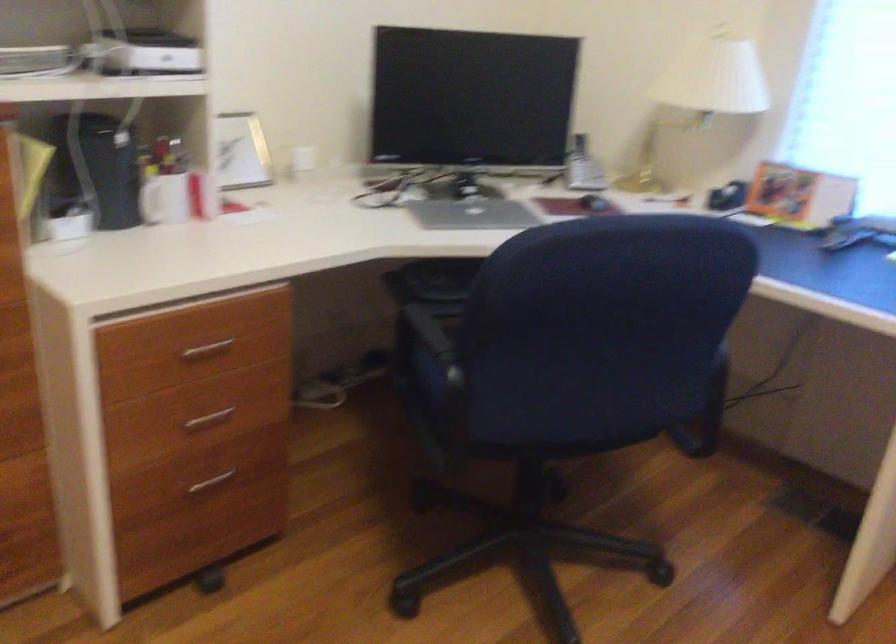
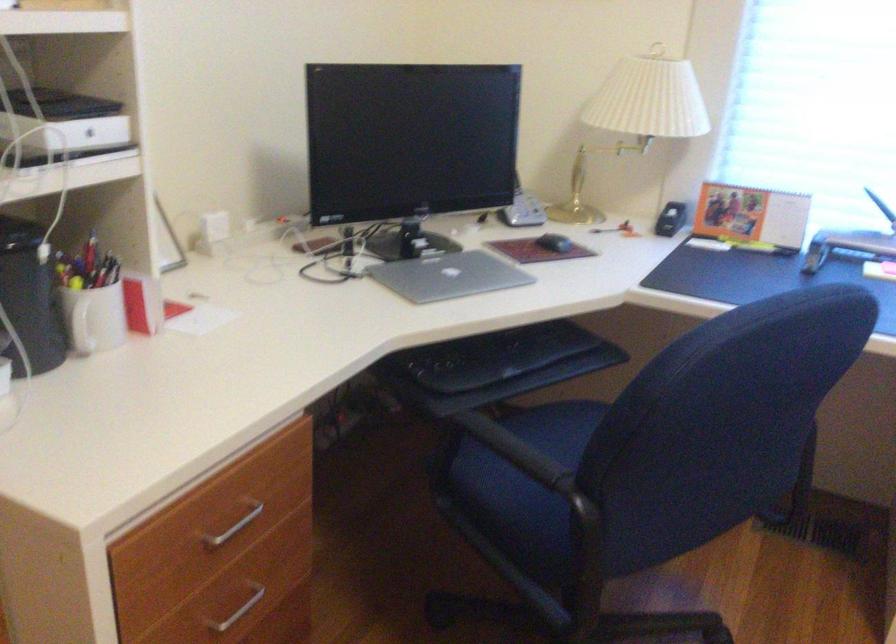
In the second image, find the point that corresponds to pixel 435 348 in the first image.

(524, 462)